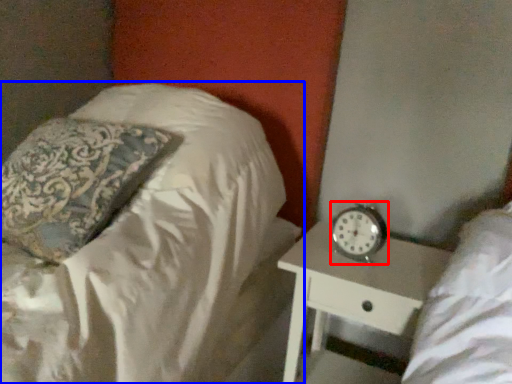
Question: Which of the following is the closest to the observer, clock (highlighted by a red box) or bed (highlighted by a blue box)?

Choices:
 (A) clock
 (B) bed

Answer: (B)